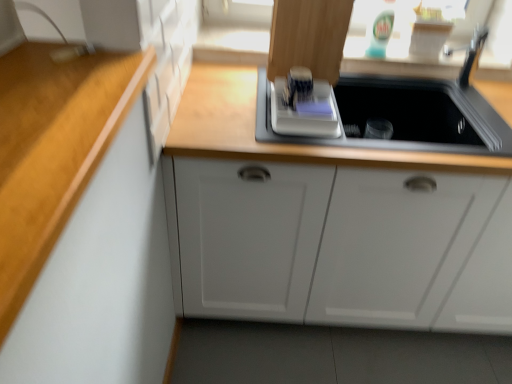
Question: Is white matte cabinet at center in front of or behind white plastic cutting board at upper center in the image?

Choices:
 (A) front
 (B) behind

Answer: (A)

Question: From a real-world perspective, is white matte cabinet at center physically located above or below white plastic cutting board at upper center?

Choices:
 (A) below
 (B) above

Answer: (A)

Question: From the image's perspective, is white matte cabinet at center above or below white plastic cutting board at upper center?

Choices:
 (A) above
 (B) below

Answer: (B)

Question: Considering the relative positions of white plastic cutting board at upper center and white matte cabinet at center in the image provided, is white plastic cutting board at upper center to the left or to the right of white matte cabinet at center?

Choices:
 (A) left
 (B) right

Answer: (A)

Question: In the image, is white plastic cutting board at upper center positioned in front of or behind white matte cabinet at center?

Choices:
 (A) behind
 (B) front

Answer: (A)

Question: From a real-world perspective, is white plastic cutting board at upper center above or below white matte cabinet at center?

Choices:
 (A) above
 (B) below

Answer: (A)

Question: Is white plastic cutting board at upper center bigger or smaller than white matte cabinet at center?

Choices:
 (A) big
 (B) small

Answer: (B)